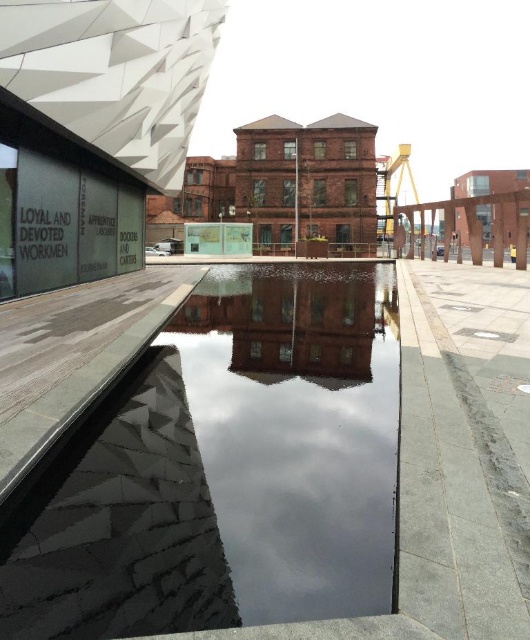
Question: Is transparent glass water at center to the right of smooth brick building at center from the viewer's perspective?

Choices:
 (A) no
 (B) yes

Answer: (B)

Question: Which of the following is the closest to the observer?

Choices:
 (A) (229, 323)
 (B) (263, 536)

Answer: (B)

Question: Can you confirm if transparent glass water at center is positioned above smooth brick building at center?

Choices:
 (A) no
 (B) yes

Answer: (A)

Question: Which of the following is the closest to the observer?

Choices:
 (A) smooth brick building at center
 (B) transparent glass water at center

Answer: (B)

Question: Is transparent glass water at center in front of smooth brick building at center?

Choices:
 (A) yes
 (B) no

Answer: (A)